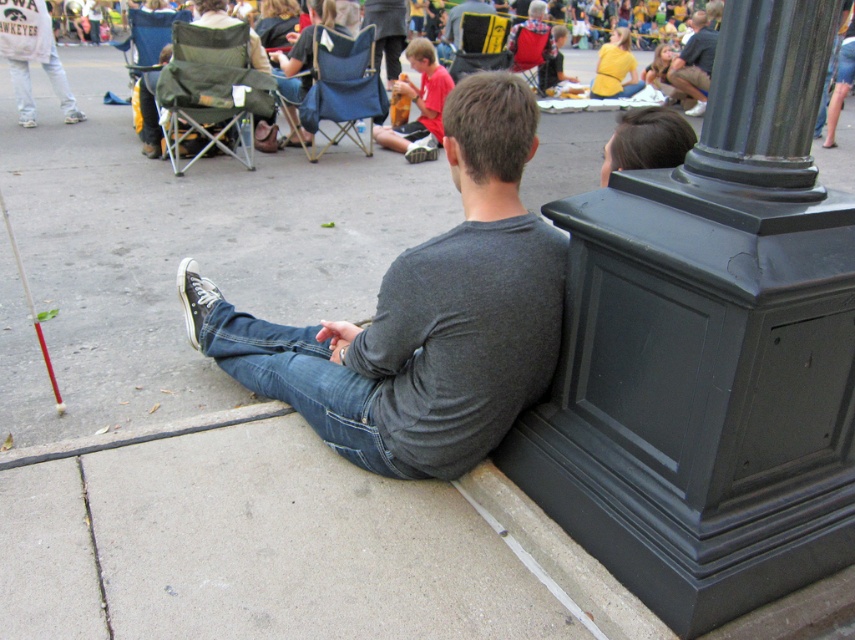
Is black polished column at upper right smaller than yellow fabric chair at center?

Indeed, black polished column at upper right has a smaller size compared to yellow fabric chair at center.

Locate an element on the screen. The height and width of the screenshot is (640, 855). black polished column at upper right is located at coordinates (765, 97).

Image resolution: width=855 pixels, height=640 pixels. What are the coordinates of `black polished column at upper right` in the screenshot? It's located at (765, 97).

Between denim at lower center and green fabric folding chair at upper left, which one is positioned higher?

green fabric folding chair at upper left is above.

Between denim at lower center and green fabric folding chair at upper left, which one appears on the left side from the viewer's perspective?

green fabric folding chair at upper left is more to the left.

The height and width of the screenshot is (640, 855). I want to click on denim at lower center, so point(301,381).

Locate an element on the screen. This screenshot has height=640, width=855. denim at lower center is located at coordinates (301, 381).

Can you confirm if dark gray cotton shirt at center is positioned to the left of dark gray shirt at center?

Correct, you'll find dark gray cotton shirt at center to the left of dark gray shirt at center.

Based on the photo, which of these two, dark gray cotton shirt at center or dark gray shirt at center, stands shorter?

With less height is dark gray cotton shirt at center.

Is point (457, 321) positioned in front of point (691, 49)?

Yes, it is in front of point (691, 49).

Find the location of `dark gray cotton shirt at center`. dark gray cotton shirt at center is located at coordinates (423, 316).